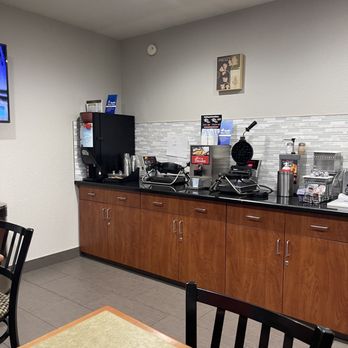
Identify the location of wall art. This screenshot has height=348, width=348. (226, 67).